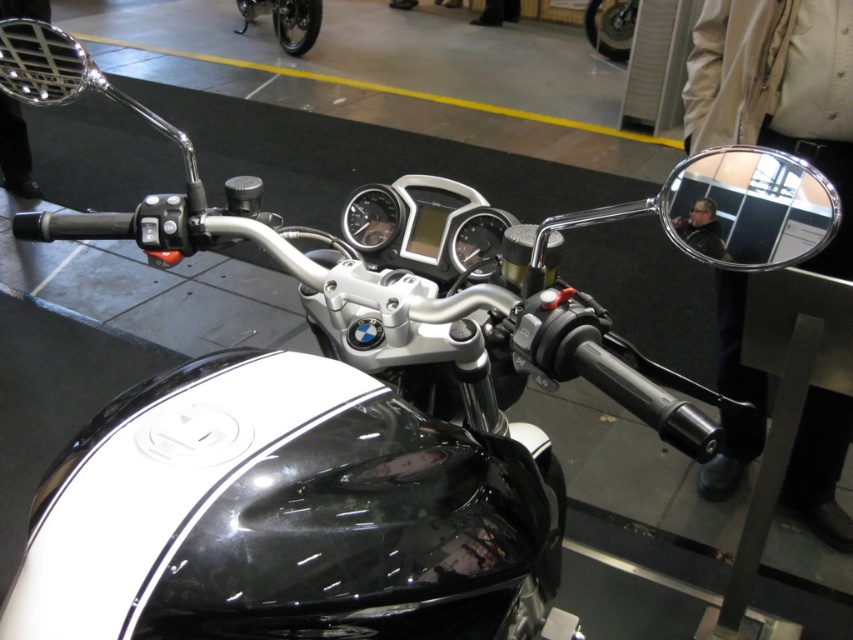
Who is taller, shiny chrome motorcycle at upper center or black glossy motorcycle at center?

shiny chrome motorcycle at upper center is taller.

Can you confirm if shiny chrome motorcycle at upper center is thinner than black glossy motorcycle at center?

In fact, shiny chrome motorcycle at upper center might be wider than black glossy motorcycle at center.

You are a GUI agent. You are given a task and a screenshot of the screen. Output one action in this format:
    pyautogui.click(x=<x>, y=<y>)
    Task: Click on the shiny chrome motorcycle at upper center
    This screenshot has width=853, height=640.
    Given the screenshot: What is the action you would take?
    pyautogui.click(x=286, y=20)

Does chrome/metallic view mirror at right appear on the left side of black glossy motorcycle at center?

Yes, chrome/metallic view mirror at right is to the left of black glossy motorcycle at center.

Who is positioned more to the left, chrome/metallic view mirror at right or black glossy motorcycle at center?

From the viewer's perspective, chrome/metallic view mirror at right appears more on the left side.

Which is in front, point (775, 177) or point (598, 4)?

Positioned in front is point (775, 177).

In order to click on chrome/metallic view mirror at right in this screenshot , I will do `click(747, 208)`.

Is chrome/metallic view mirror at right bigger than shiny chrome motorcycle at upper center?

Actually, chrome/metallic view mirror at right might be smaller than shiny chrome motorcycle at upper center.

Does point (675, 216) lie in front of point (305, 12)?

That is True.

Which is in front, point (788, 232) or point (299, 51)?

Point (788, 232) is more forward.

I want to click on chrome/metallic view mirror at right, so click(747, 208).